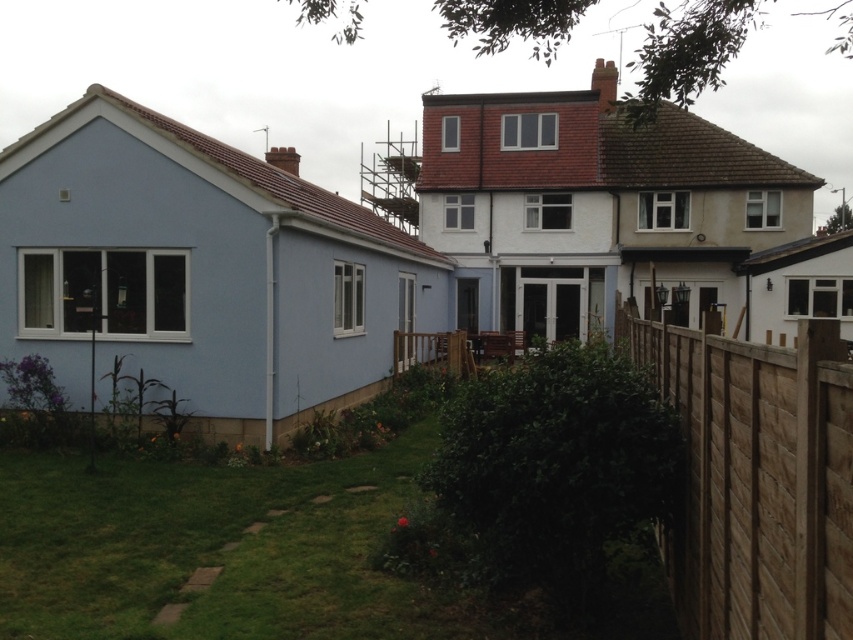
You are standing in the residential area and want to walk from the green grass at lower left to the brown wooden fence at right. Which direction should you move in?

You should move to the right to reach the brown wooden fence at right from the green grass at lower left since the green grass at lower left is to the left of brown wooden fence at right.

You are standing at the center of the image and want to walk towards the green grass at lower left. In which direction should you move relative to the houses?

The green grass at lower left is located at point (270, 554), so you should move towards the lower left direction relative to the houses.